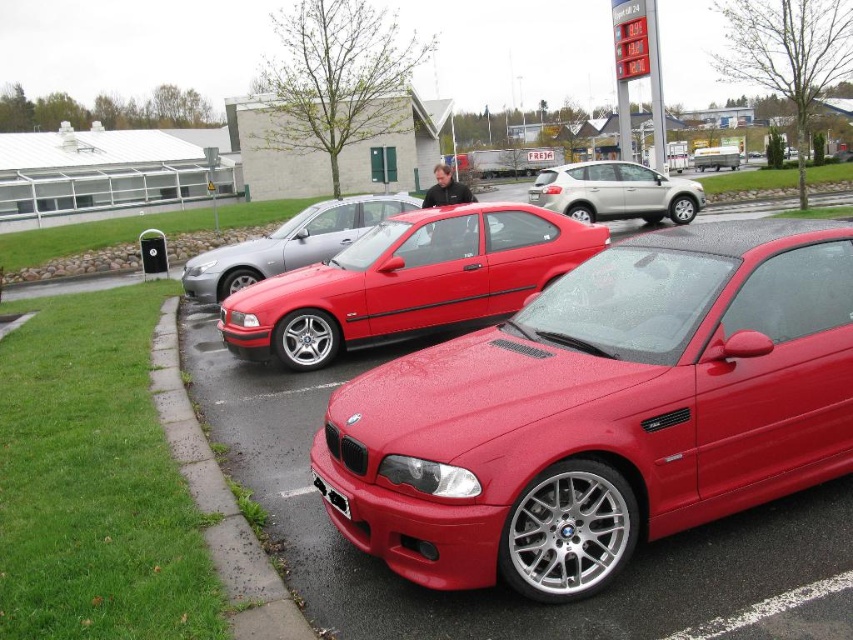
Between point (479, 259) and point (625, 163), which one is positioned behind?

Point (625, 163)

Is matte red car at center positioned before satin silver suv at center?

Yes, matte red car at center is closer to the viewer.

What do you see at coordinates (407, 282) in the screenshot?
I see `matte red car at center` at bounding box center [407, 282].

Identify the location of matte red car at center. (407, 282).

Is point (315, 624) positioned before point (325, 497)?

Yes.

Where is `shiny red car at center`? Image resolution: width=853 pixels, height=640 pixels. shiny red car at center is located at coordinates (500, 589).

Locate an element on the screen. The height and width of the screenshot is (640, 853). concrete at lower left is located at coordinates (218, 502).

Is point (219, 566) positioned behind point (369, 218)?

That is False.

At what (x,y) coordinates should I click in order to perform the action: click on concrete at lower left. Please return your answer as a coordinate pair (x, y). Image resolution: width=853 pixels, height=640 pixels. Looking at the image, I should click on [218, 502].